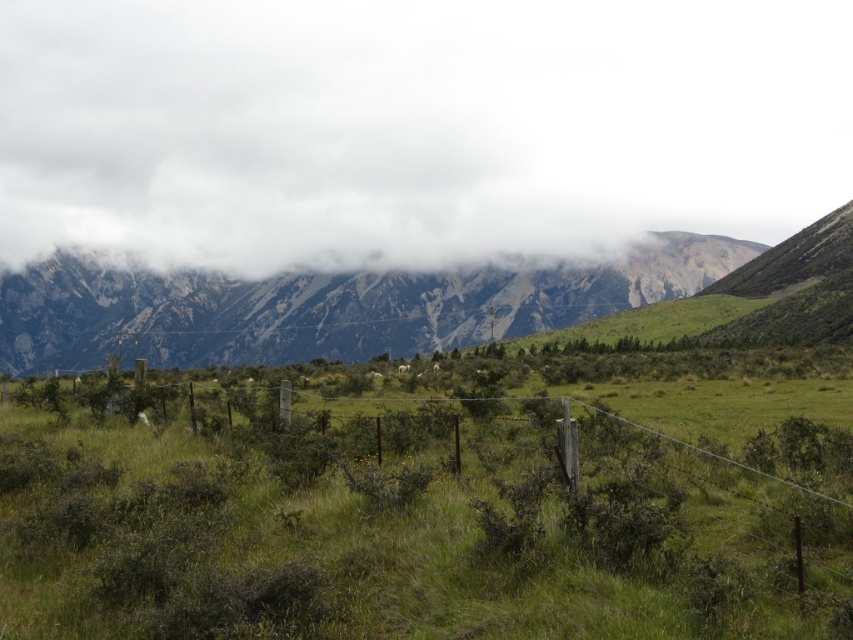
You are an airplane pilot flying over a rural landscape. You notice a white fluffy cloud at upper center and a rugged stone mountain range at center. Which object appears taller from your perspective?

The white fluffy cloud at upper center appears taller than the rugged stone mountain range at center from your perspective.

Based on the scene, which object has a greater width between the white fluffy cloud at upper center and the green grassy at center?

The white fluffy cloud at upper center has a greater width than the green grassy at center.